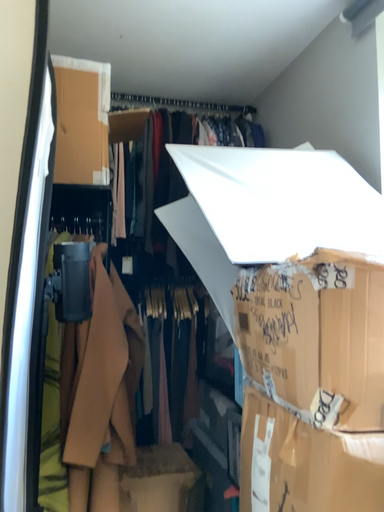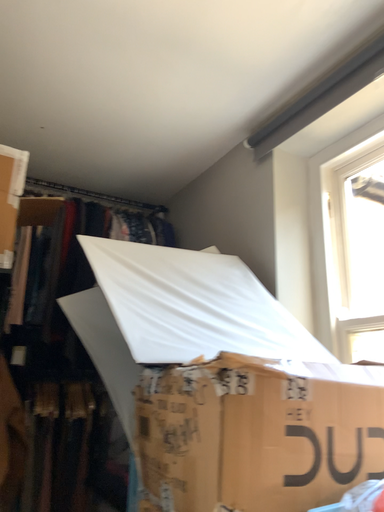
Question: How did the camera likely rotate when shooting the video?

Choices:
 (A) rotated right
 (B) rotated left

Answer: (A)